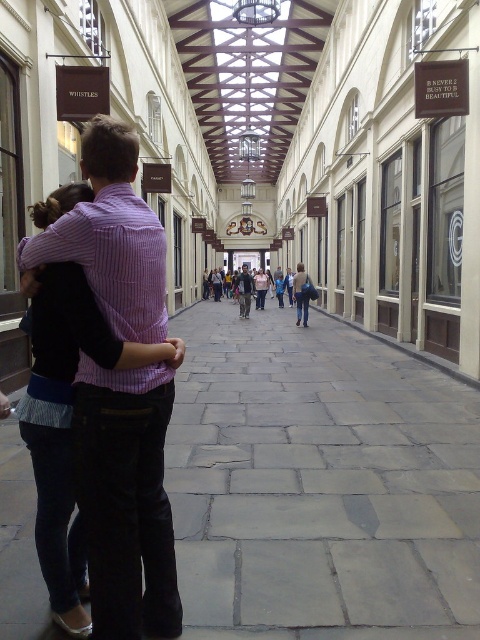
Question: Which object is closer to the camera taking this photo?

Choices:
 (A) black denim jeans at left
 (B) light pink fabric dress at center
 (C) denim jacket at center
 (D) matte pink shirt at center

Answer: (A)

Question: Which point appears closest to the camera in this image?

Choices:
 (A) (49, 289)
 (B) (239, 289)

Answer: (A)

Question: Is denim jacket at center bigger than light pink fabric dress at center?

Choices:
 (A) yes
 (B) no

Answer: (A)

Question: Does denim jacket at center have a smaller size compared to light pink fabric dress at center?

Choices:
 (A) no
 (B) yes

Answer: (A)

Question: Can you confirm if black denim jeans at left is positioned above light pink fabric dress at center?

Choices:
 (A) no
 (B) yes

Answer: (A)

Question: Which of the following is the closest to the observer?

Choices:
 (A) (248, 285)
 (B) (72, 348)

Answer: (B)